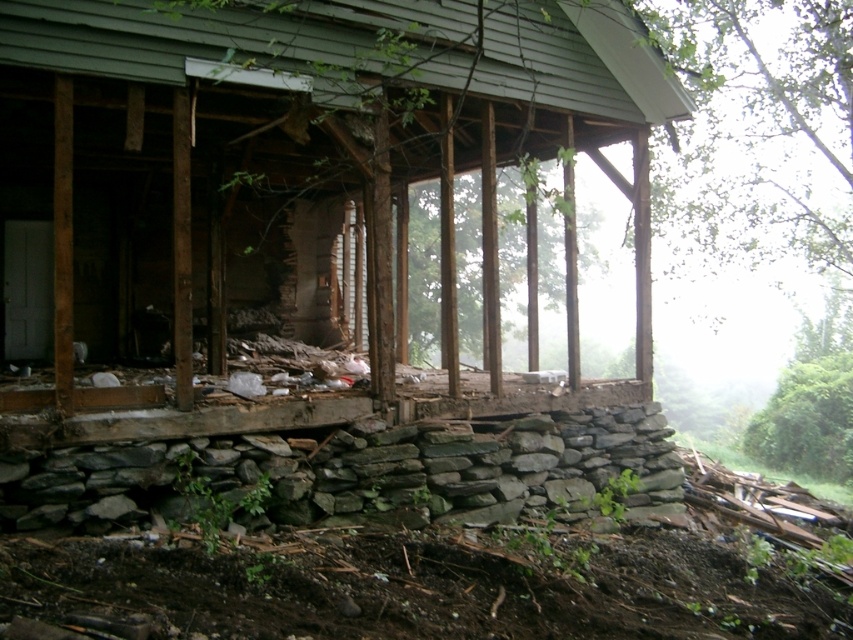
Which of these two, weathered wood porch at center or gray rough stone wall at lower center, stands taller?

Standing taller between the two is weathered wood porch at center.

Is point (347, 64) positioned after point (235, 500)?

Yes, point (347, 64) is behind point (235, 500).

Describe the element at coordinates (283, 164) in the screenshot. I see `weathered wood porch at center` at that location.

This screenshot has width=853, height=640. Identify the location of weathered wood porch at center. (283, 164).

Does gray rough stone wall at lower center appear on the left side of rusty wood porch at center?

In fact, gray rough stone wall at lower center is to the right of rusty wood porch at center.

Is the position of gray rough stone wall at lower center more distant than that of rusty wood porch at center?

Yes, it is.

In order to click on gray rough stone wall at lower center in this screenshot , I will do `click(358, 467)`.

Is weathered wood porch at center in front of rusty wood porch at center?

Yes, weathered wood porch at center is in front of rusty wood porch at center.

Which is below, weathered wood porch at center or rusty wood porch at center?

rusty wood porch at center

Measure the distance between point (177,284) and camera.

A distance of 6.36 meters exists between point (177,284) and camera.

Identify the location of weathered wood porch at center. This screenshot has height=640, width=853. (283, 164).